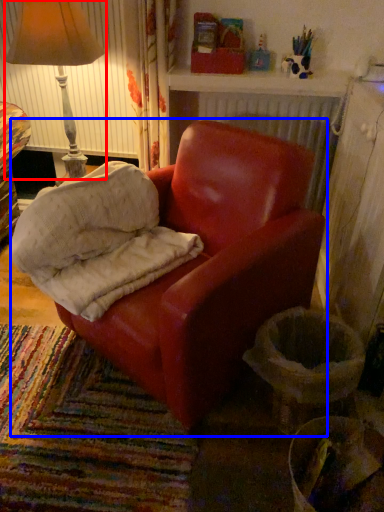
Question: Which object is closer to the camera taking this photo, lamp (highlighted by a red box) or chair (highlighted by a blue box)?

Choices:
 (A) lamp
 (B) chair

Answer: (B)